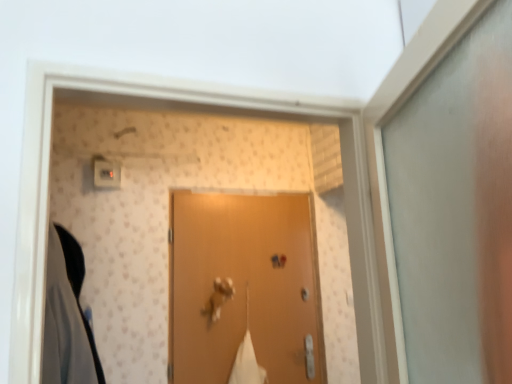
Question: Is metallic gold door handle at center closer to camera compared to matte brown door at center?

Choices:
 (A) yes
 (B) no

Answer: (B)

Question: From the image's perspective, is metallic gold door handle at center located beneath matte brown door at center?

Choices:
 (A) yes
 (B) no

Answer: (A)

Question: Does metallic gold door handle at center have a smaller size compared to matte brown door at center?

Choices:
 (A) yes
 (B) no

Answer: (A)

Question: Can you confirm if metallic gold door handle at center is positioned to the right of matte brown door at center?

Choices:
 (A) no
 (B) yes

Answer: (A)

Question: Is metallic gold door handle at center taller than matte brown door at center?

Choices:
 (A) no
 (B) yes

Answer: (A)

Question: Could you tell me if metallic gold door handle at center is turned towards matte brown door at center?

Choices:
 (A) yes
 (B) no

Answer: (B)

Question: Is matte plastic light switch at upper left surrounding matte brown door at center?

Choices:
 (A) no
 (B) yes

Answer: (A)

Question: Considering the relative sizes of matte plastic light switch at upper left and matte brown door at center in the image provided, is matte plastic light switch at upper left thinner than matte brown door at center?

Choices:
 (A) yes
 (B) no

Answer: (B)

Question: Is matte plastic light switch at upper left placed right next to matte brown door at center?

Choices:
 (A) no
 (B) yes

Answer: (A)

Question: Can you confirm if matte plastic light switch at upper left is positioned to the left of matte brown door at center?

Choices:
 (A) yes
 (B) no

Answer: (A)

Question: Is matte plastic light switch at upper left not within matte brown door at center?

Choices:
 (A) yes
 (B) no

Answer: (A)

Question: Can you confirm if matte plastic light switch at upper left is shorter than matte brown door at center?

Choices:
 (A) yes
 (B) no

Answer: (A)

Question: Does matte brown door at center have a smaller size compared to matte plastic light switch at upper left?

Choices:
 (A) yes
 (B) no

Answer: (B)